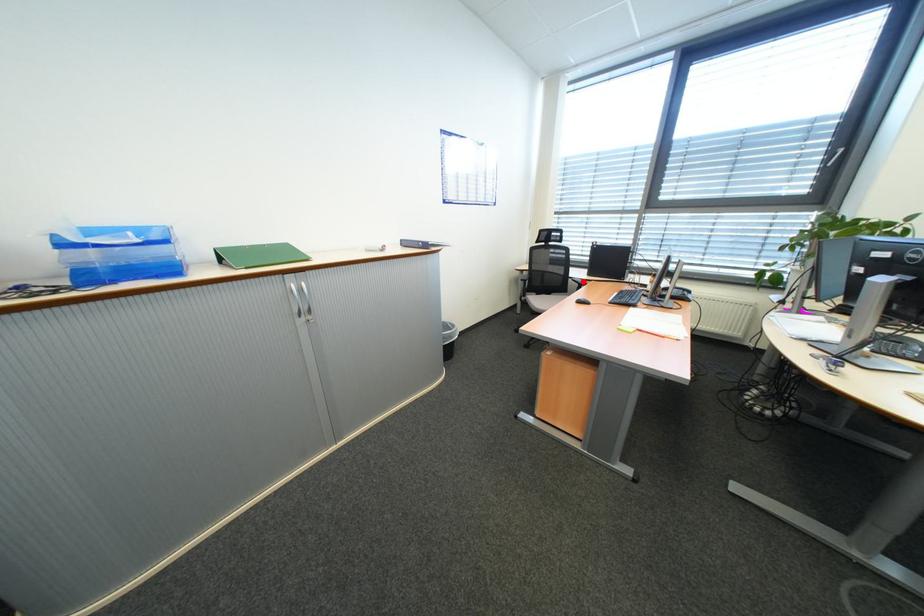
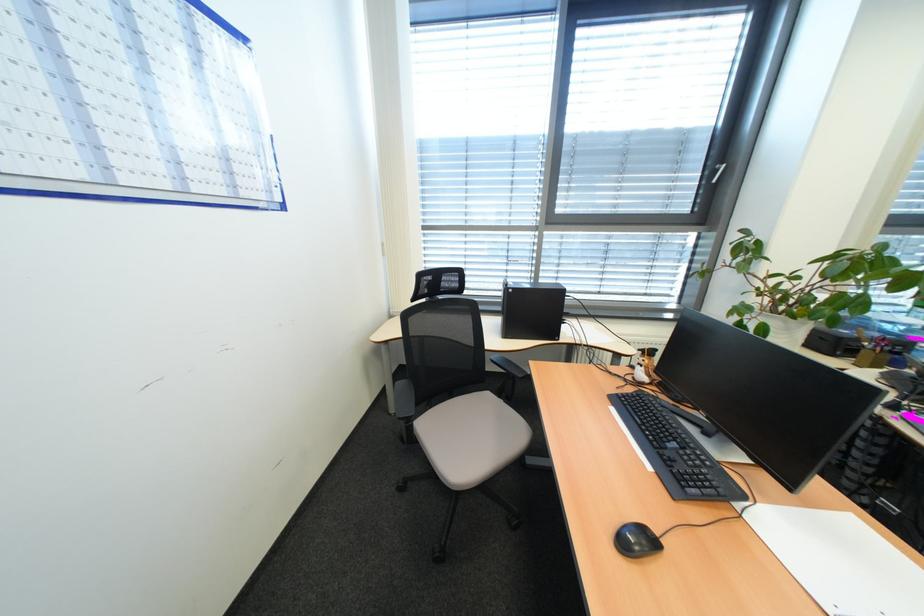
The point at the highlighted location is marked in the first image. Where is the corresponding point in the second image?

(503, 362)